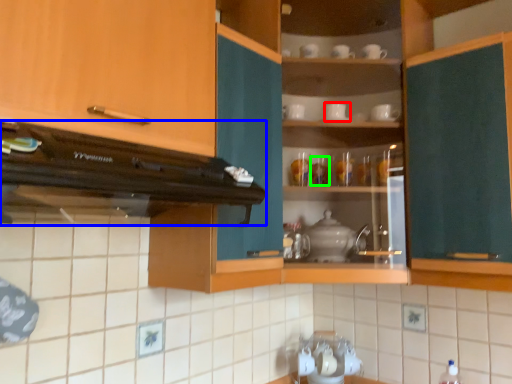
Question: Estimate the real-world distances between objects in this image. Which object is closer to tableware (highlighted by a red box), home appliance (highlighted by a blue box) or tableware (highlighted by a green box)?

Choices:
 (A) home appliance
 (B) tableware

Answer: (B)